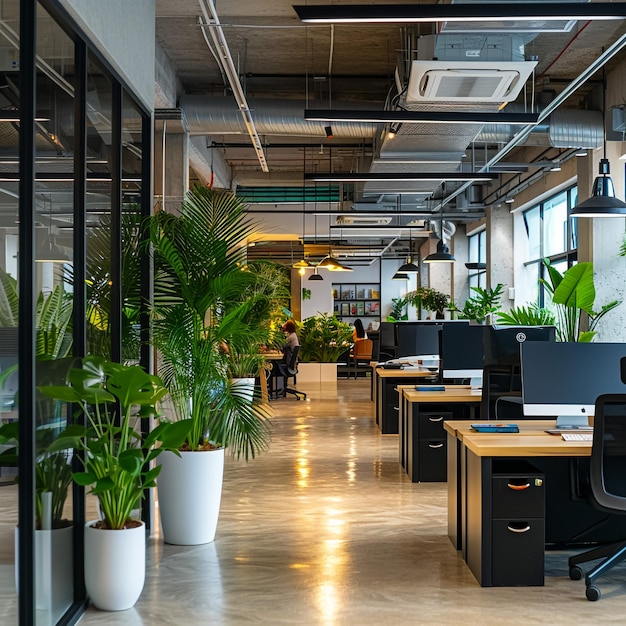
You are a GUI agent. You are given a task and a screenshot of the screen. Output one action in this format:
    pyautogui.click(x=<x>, y=<y>)
    Task: Click on the inside of an office building
    The width and height of the screenshot is (626, 626).
    Given the screenshot: What is the action you would take?
    pyautogui.click(x=322, y=402)